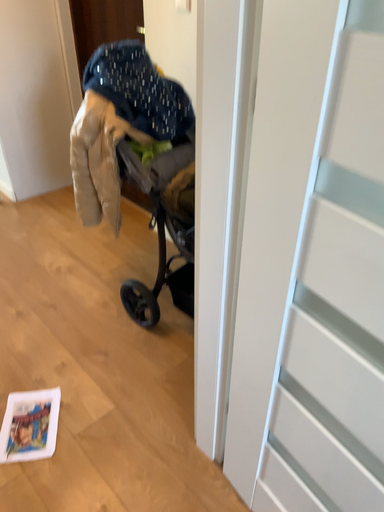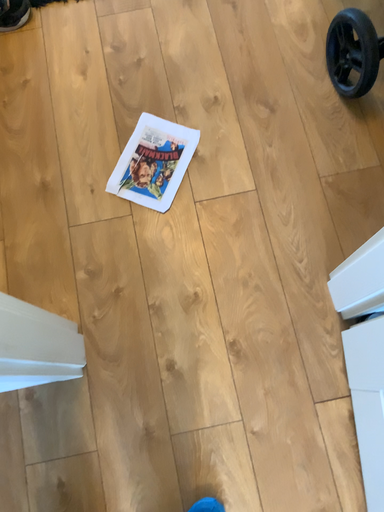
Question: Which way did the camera rotate in the video?

Choices:
 (A) rotated right
 (B) rotated left

Answer: (B)